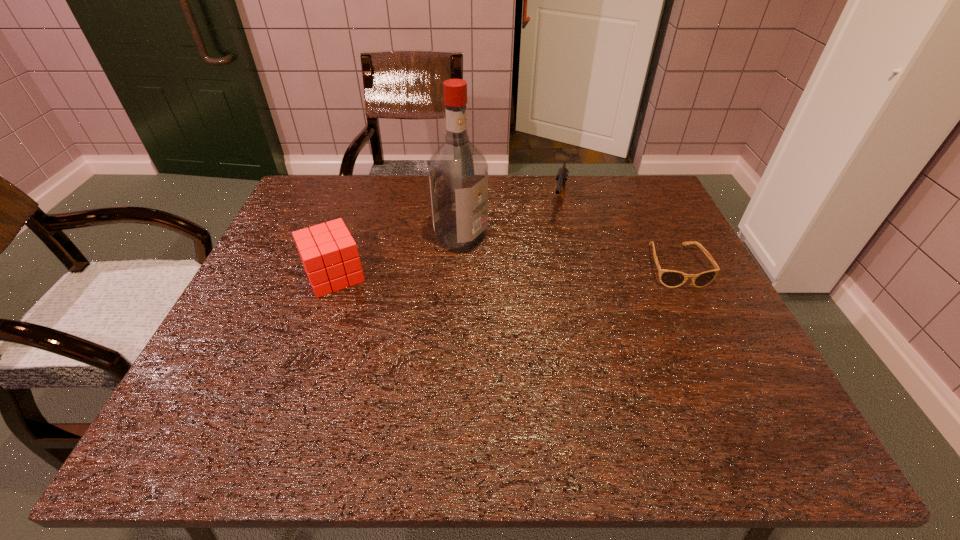
In the image, there is a desktop. Where is `vacant space at the right edge`? This screenshot has height=540, width=960. vacant space at the right edge is located at coordinates (736, 330).

Find the location of `vacant point at the far left corner`. vacant point at the far left corner is located at coordinates (324, 199).

Image resolution: width=960 pixels, height=540 pixels. I want to click on free space at the near left corner, so click(x=212, y=393).

Locate an element on the screen. This screenshot has height=540, width=960. vacant space at the far right corner is located at coordinates (636, 201).

Locate an element on the screen. vacant region between the gun and the second object from left to right is located at coordinates (510, 222).

This screenshot has width=960, height=540. I want to click on free point between the second object from left to right and the cube, so click(x=397, y=256).

This screenshot has width=960, height=540. Find the location of `free space between the tallest object and the cube`. free space between the tallest object and the cube is located at coordinates (397, 256).

Image resolution: width=960 pixels, height=540 pixels. I want to click on free space between the tallest object and the rightmost object, so click(567, 252).

Identify the location of vacant space that's between the cube and the third object from right to left. (397, 256).

Where is `vacant area that lies between the leftmost object and the tallest object`? The image size is (960, 540). vacant area that lies between the leftmost object and the tallest object is located at coordinates (397, 256).